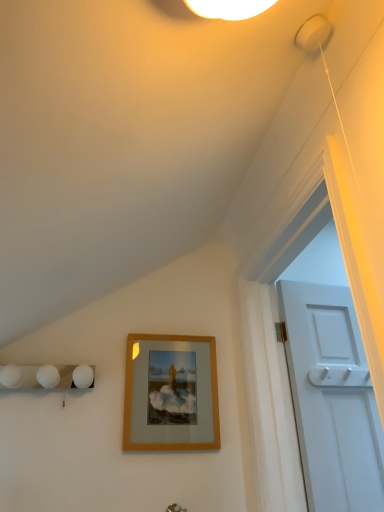
Question: From the image's perspective, is silver metallic door handle at lower center located above wooden frame at center?

Choices:
 (A) yes
 (B) no

Answer: (B)

Question: Considering the relative sizes of silver metallic door handle at lower center and wooden frame at center in the image provided, is silver metallic door handle at lower center smaller than wooden frame at center?

Choices:
 (A) yes
 (B) no

Answer: (A)

Question: Can you confirm if silver metallic door handle at lower center is bigger than wooden frame at center?

Choices:
 (A) no
 (B) yes

Answer: (A)

Question: Is wooden frame at center located within silver metallic door handle at lower center?

Choices:
 (A) no
 (B) yes

Answer: (A)

Question: Is silver metallic door handle at lower center positioned in front of wooden frame at center?

Choices:
 (A) yes
 (B) no

Answer: (A)

Question: Is silver metallic door handle at lower center thinner than wooden frame at center?

Choices:
 (A) no
 (B) yes

Answer: (A)

Question: Is wooden frame at center taller than silver metallic door handle at lower center?

Choices:
 (A) yes
 (B) no

Answer: (A)

Question: Does wooden frame at center have a lesser width compared to silver metallic door handle at lower center?

Choices:
 (A) no
 (B) yes

Answer: (B)

Question: From the image's perspective, is wooden frame at center above silver metallic door handle at lower center?

Choices:
 (A) yes
 (B) no

Answer: (A)

Question: From a real-world perspective, does wooden frame at center stand above silver metallic door handle at lower center?

Choices:
 (A) no
 (B) yes

Answer: (B)

Question: From a real-world perspective, is wooden frame at center physically below silver metallic door handle at lower center?

Choices:
 (A) no
 (B) yes

Answer: (A)

Question: Does wooden frame at center appear on the left side of silver metallic door handle at lower center?

Choices:
 (A) no
 (B) yes

Answer: (B)

Question: In the image, is silver metallic door handle at lower center positioned in front of or behind wooden frame at center?

Choices:
 (A) behind
 (B) front

Answer: (B)